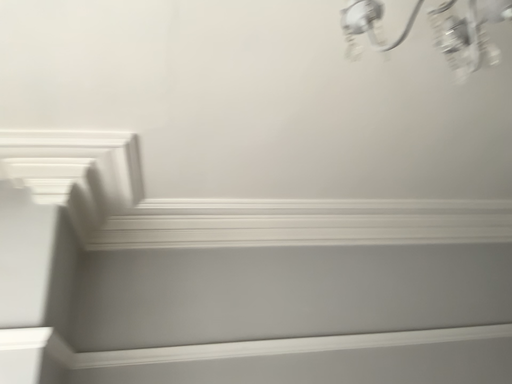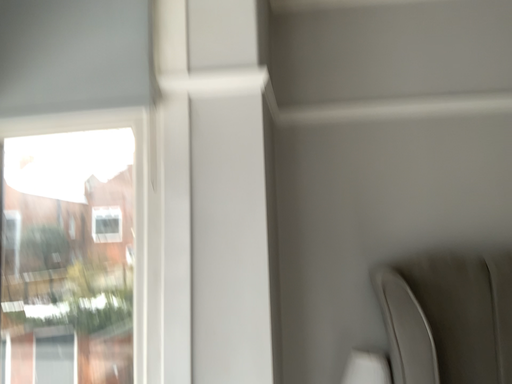
Question: Which way did the camera rotate in the video?

Choices:
 (A) rotated upward
 (B) rotated downward

Answer: (B)